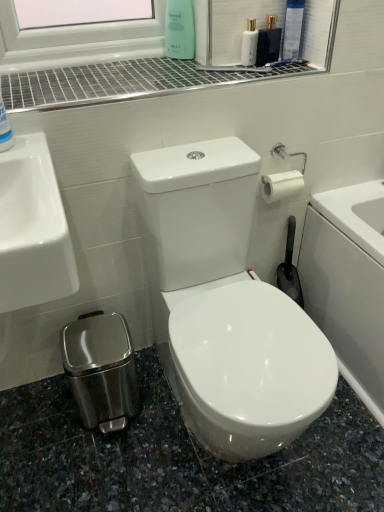
Locate an element on the screen. Image resolution: width=384 pixels, height=512 pixels. free location to the left of white glossy toilet at center is located at coordinates (89, 441).